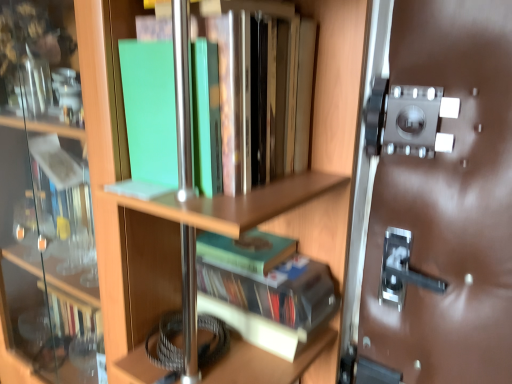
Image resolution: width=512 pixels, height=384 pixels. I want to click on free space above green matte book at center, the second book positioned from the bottom (from a real-world perspective), so click(253, 240).